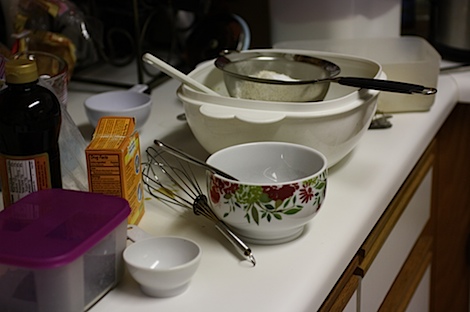
Locate an element on the screen. countertop is located at coordinates (366, 174).